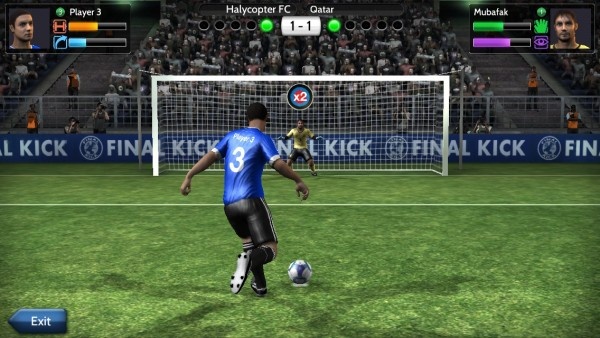
At what (x,y) coordinates should I click in order to perform the action: click on stairs. Please return your answer as a coordinate pair (x, y). This screenshot has width=600, height=338. Looking at the image, I should click on (502, 95).